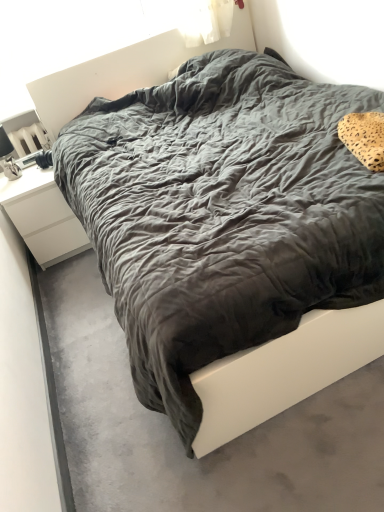
Question: From the image's perspective, is dark gray fabric bed at center over white matte nightstand at left?

Choices:
 (A) no
 (B) yes

Answer: (A)

Question: From the image's perspective, is dark gray fabric bed at center under white matte nightstand at left?

Choices:
 (A) yes
 (B) no

Answer: (A)

Question: Can white matte nightstand at left be found inside dark gray fabric bed at center?

Choices:
 (A) no
 (B) yes

Answer: (A)

Question: Is dark gray fabric bed at center at the right side of white matte nightstand at left?

Choices:
 (A) no
 (B) yes

Answer: (B)

Question: Is dark gray fabric bed at center wider than white matte nightstand at left?

Choices:
 (A) yes
 (B) no

Answer: (A)

Question: In terms of size, does white matte nightstand at left appear bigger or smaller than dark gray fabric bed at center?

Choices:
 (A) big
 (B) small

Answer: (A)

Question: From the image's perspective, relative to dark gray fabric bed at center, is white matte nightstand at left above or below?

Choices:
 (A) below
 (B) above

Answer: (B)

Question: In terms of width, does white matte nightstand at left look wider or thinner when compared to dark gray fabric bed at center?

Choices:
 (A) thin
 (B) wide

Answer: (A)

Question: From a real-world perspective, is white matte nightstand at left physically located above or below dark gray fabric bed at center?

Choices:
 (A) below
 (B) above

Answer: (B)

Question: Is point (74, 258) positioned closer to the camera than point (365, 154)?

Choices:
 (A) farther
 (B) closer

Answer: (A)

Question: Visually, is dark gray fabric bed at center positioned to the left or to the right of leopard print fabric pillow at upper right?

Choices:
 (A) left
 (B) right

Answer: (A)

Question: Considering their positions, is dark gray fabric bed at center located in front of or behind leopard print fabric pillow at upper right?

Choices:
 (A) front
 (B) behind

Answer: (A)

Question: Is dark gray fabric bed at center spatially inside leopard print fabric pillow at upper right, or outside of it?

Choices:
 (A) outside
 (B) inside

Answer: (A)

Question: Based on their positions, is dark gray fabric bed at center located to the left or right of white matte nightstand at left?

Choices:
 (A) right
 (B) left

Answer: (A)

Question: Relative to white matte nightstand at left, is dark gray fabric bed at center in front or behind?

Choices:
 (A) front
 (B) behind

Answer: (A)